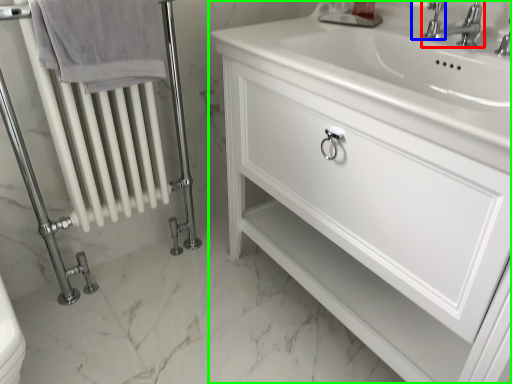
Question: Estimate the real-world distances between objects in this image. Which object is closer to tap (highlighted by a red box), plumbing fixture (highlighted by a blue box) or bathroom cabinet (highlighted by a green box)?

Choices:
 (A) plumbing fixture
 (B) bathroom cabinet

Answer: (A)